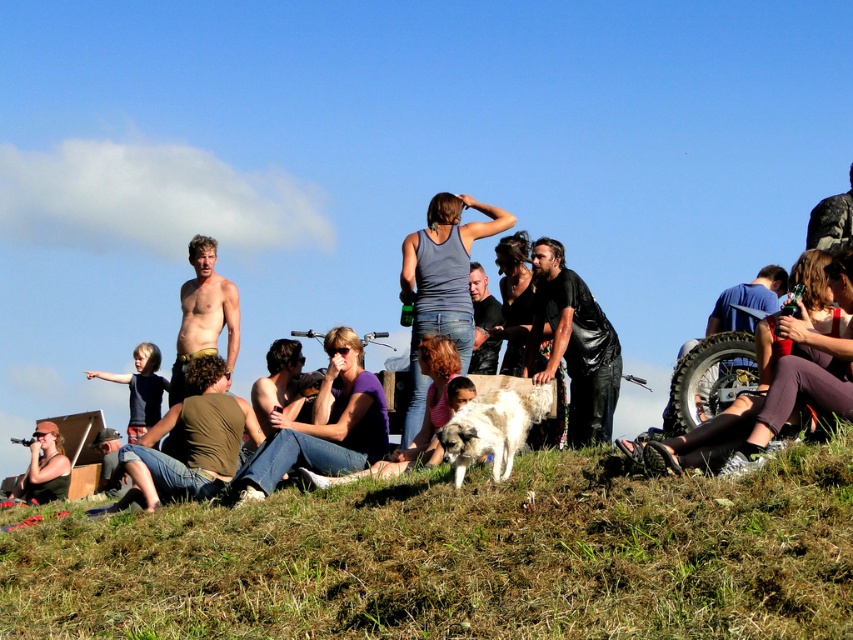
Is black leather jacket at center taller than shiny skin torso at center?

Yes, black leather jacket at center is taller than shiny skin torso at center.

Is point (573, 353) farther from camera compared to point (201, 273)?

No, (573, 353) is closer to viewer.

The height and width of the screenshot is (640, 853). Describe the element at coordinates (573, 344) in the screenshot. I see `black leather jacket at center` at that location.

This screenshot has height=640, width=853. I want to click on black leather jacket at center, so click(573, 344).

This screenshot has height=640, width=853. What do you see at coordinates (190, 442) in the screenshot?
I see `green cotton shirt at lower left` at bounding box center [190, 442].

Between point (231, 419) and point (498, 340), which one is positioned behind?

The point (498, 340) is behind.

Where is `green cotton shirt at lower left`? The width and height of the screenshot is (853, 640). green cotton shirt at lower left is located at coordinates (190, 442).

Between black leather jacket at center and green cotton shirt at lower left, which one is positioned lower?

green cotton shirt at lower left is lower down.

Who is more distant from viewer, (567, 300) or (167, 429)?

The point (567, 300) is behind.

Locate an element on the screen. The image size is (853, 640). black leather jacket at center is located at coordinates (573, 344).